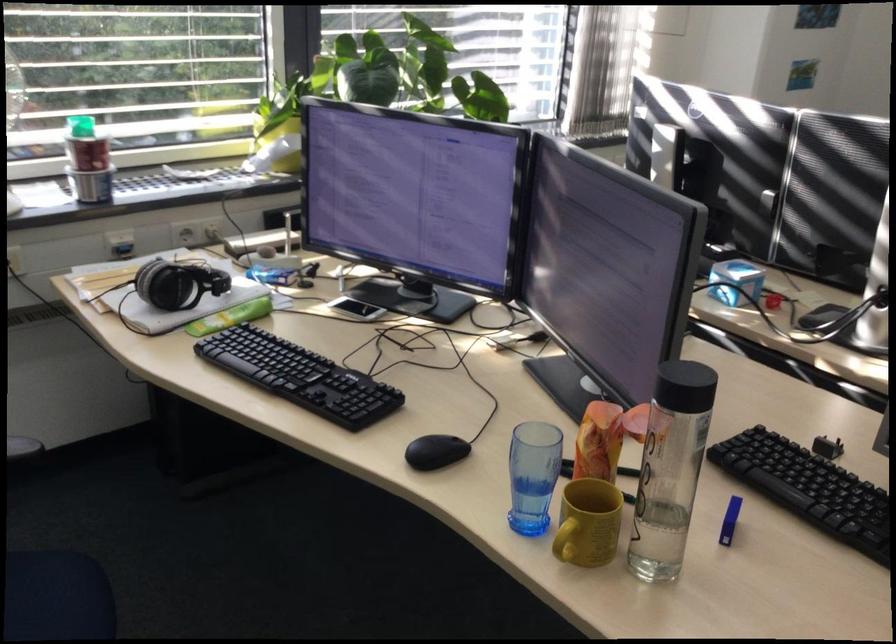
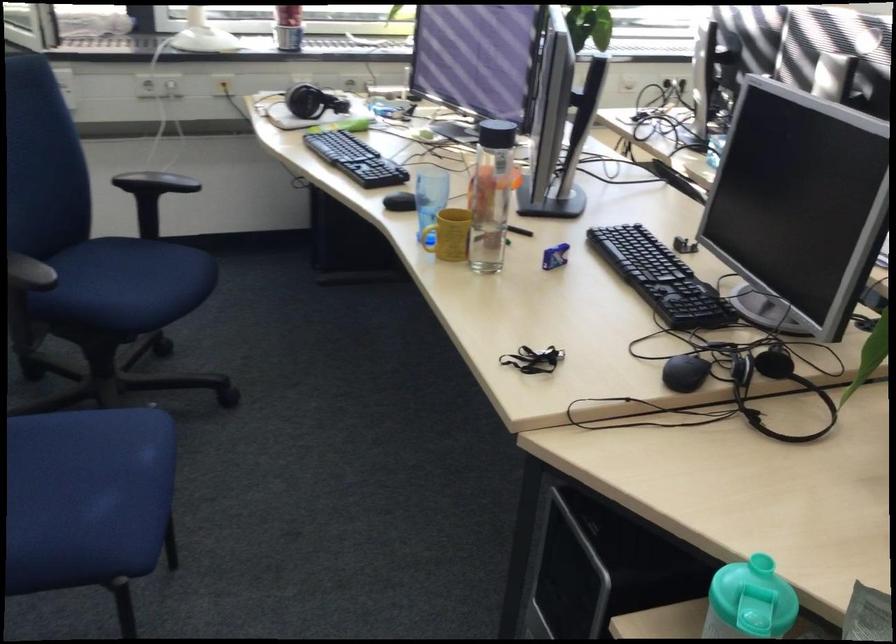
Question: Based on the continuous images, in which direction is the camera rotating? Reply with the corresponding letter.

Choices:
 (A) Left
 (B) Right
 (C) Up
 (D) Down

Answer: (A)